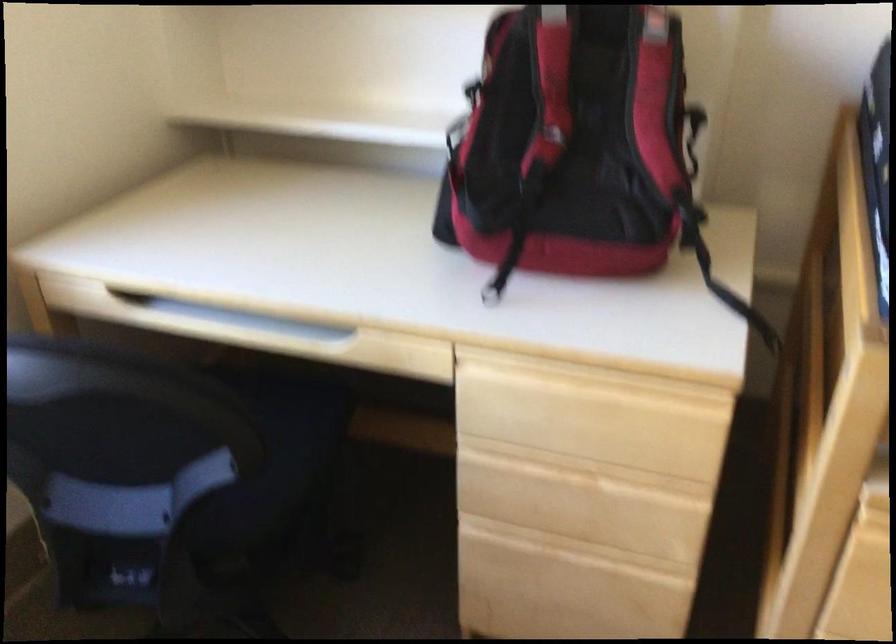
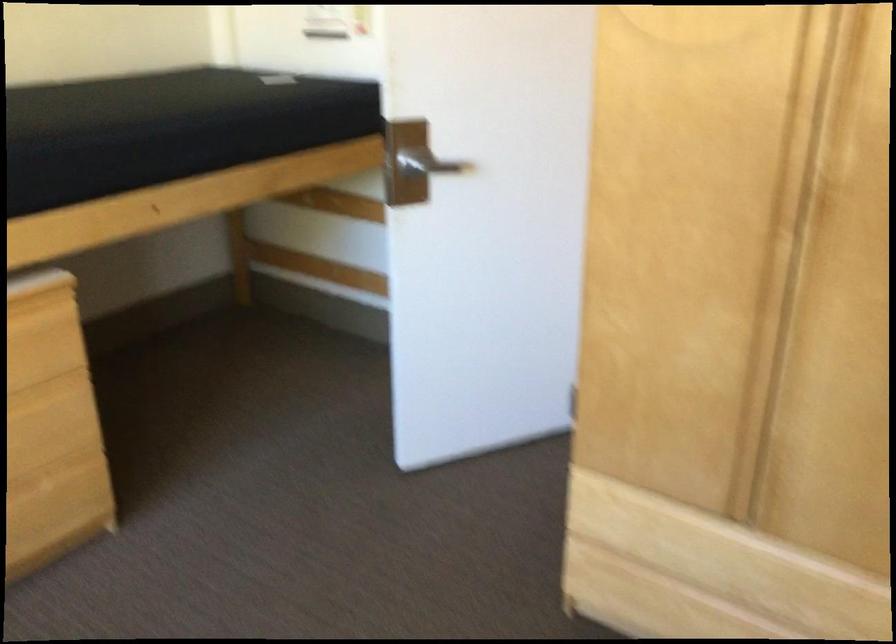
Question: The images are taken continuously from a first-person perspective. In which direction is your viewpoint rotating?

Choices:
 (A) Left
 (B) Right
 (C) Up
 (D) Down

Answer: (B)